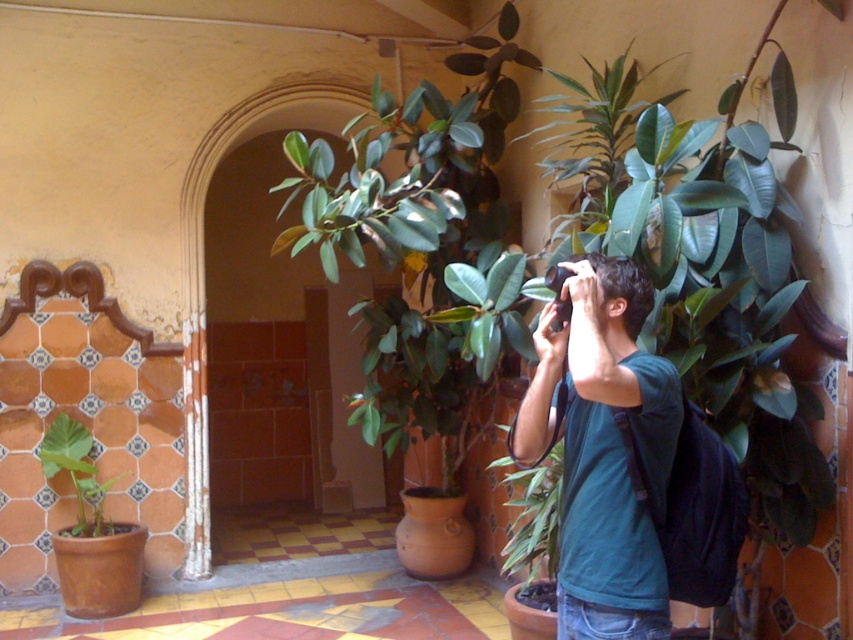
Question: Considering the real-world distances, which object is closest to the green matte shirt at center?

Choices:
 (A) green leafy plant at center
 (B) green matte leafy plant at lower left

Answer: (A)

Question: Can you confirm if green leafy plant at center is positioned to the left of green matte leafy plant at lower left?

Choices:
 (A) yes
 (B) no

Answer: (B)

Question: Considering the real-world distances, which object is farthest from the green matte leafy plant at lower left?

Choices:
 (A) green matte shirt at center
 (B) green leafy plant at center

Answer: (A)

Question: Considering the relative positions of green matte shirt at center and green matte leafy plant at lower left in the image provided, where is green matte shirt at center located with respect to green matte leafy plant at lower left?

Choices:
 (A) above
 (B) below

Answer: (A)

Question: Which point is closer to the camera?

Choices:
 (A) green leafy plant at center
 (B) green matte leafy plant at lower left
 (C) green matte shirt at center

Answer: (C)

Question: Does green matte shirt at center appear under green matte leafy plant at lower left?

Choices:
 (A) yes
 (B) no

Answer: (B)